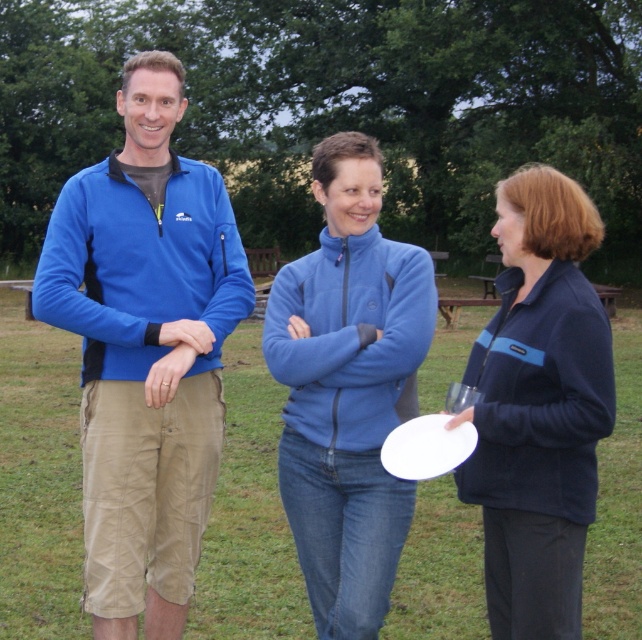
Question: Is the position of navy blue fleece at center more distant than that of white plastic frisbee at center?

Choices:
 (A) yes
 (B) no

Answer: (A)

Question: Which point is closer to the camera?

Choices:
 (A) fleece jacket at center
 (B) matte blue fleece at center
 (C) navy blue fleece at center
 (D) white plastic frisbee at center

Answer: (D)

Question: Which of the following is the farthest from the observer?

Choices:
 (A) (508, 438)
 (B) (376, 241)

Answer: (B)

Question: Among these objects, which one is farthest from the camera?

Choices:
 (A) navy blue fleece at center
 (B) matte blue fleece at center
 (C) white plastic frisbee at center
 (D) fleece jacket at center

Answer: (B)

Question: Does fleece jacket at center appear on the right side of navy blue fleece at center?

Choices:
 (A) yes
 (B) no

Answer: (B)

Question: Can you confirm if fleece jacket at center is bigger than navy blue fleece at center?

Choices:
 (A) yes
 (B) no

Answer: (B)